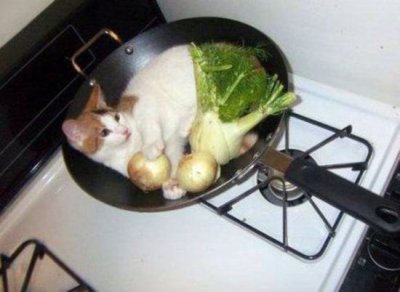
Identify the location of white gas stove. This screenshot has width=400, height=292. 211,257.